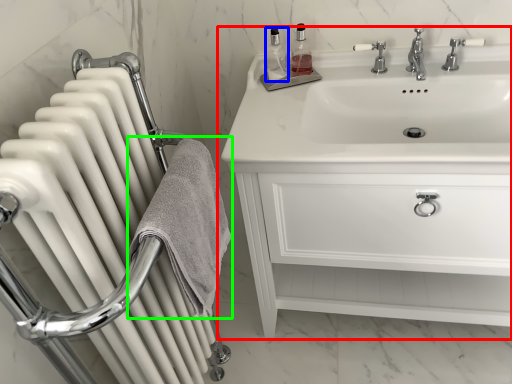
Question: Based on their relative distances, which object is nearer to bathroom cabinet (highlighted by a red box)? Choose from toiletry (highlighted by a blue box) and bath towel (highlighted by a green box).

Choices:
 (A) toiletry
 (B) bath towel

Answer: (B)